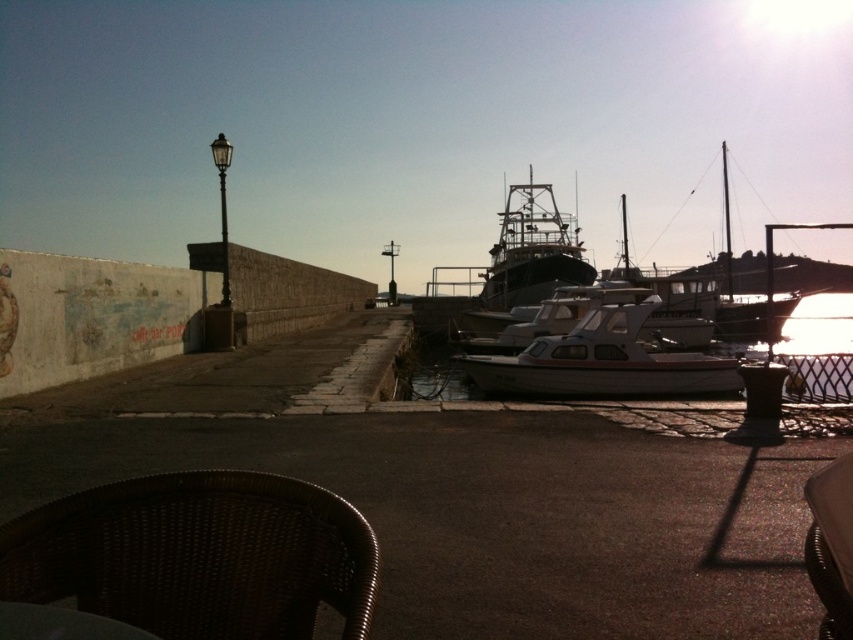
Who is shorter, white glossy boat at center or brown wicker chair at lower right?

Standing shorter between the two is white glossy boat at center.

Who is more forward, (612, 380) or (817, 506)?

Point (817, 506) is in front.

I want to click on white glossy boat at center, so point(602,362).

Does dark green matte boat at center have a smaller size compared to brown wicker table at lower left?

Actually, dark green matte boat at center might be larger than brown wicker table at lower left.

Is dark green matte boat at center wider than brown wicker table at lower left?

Indeed, dark green matte boat at center has a greater width compared to brown wicker table at lower left.

Between point (544, 188) and point (10, 604), which one is positioned behind?

Positioned behind is point (544, 188).

Where is `dark green matte boat at center`? The width and height of the screenshot is (853, 640). dark green matte boat at center is located at coordinates (511, 268).

Is white glossy boat at center closer to the viewer compared to brown wicker table at lower left?

No, white glossy boat at center is behind brown wicker table at lower left.

Can you confirm if white glossy boat at center is taller than brown wicker table at lower left?

Correct, white glossy boat at center is much taller as brown wicker table at lower left.

Image resolution: width=853 pixels, height=640 pixels. Identify the location of white glossy boat at center. (602, 362).